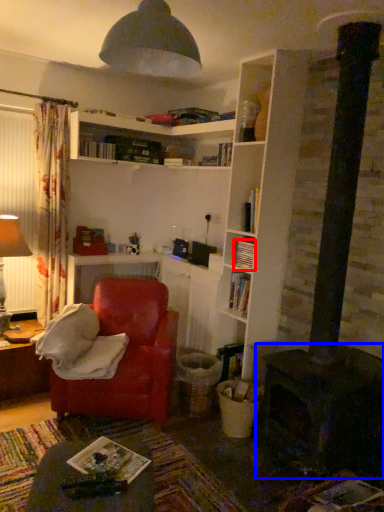
Question: Which object appears closest to the camera in this image, book (highlighted by a red box) or fireplace (highlighted by a blue box)?

Choices:
 (A) book
 (B) fireplace

Answer: (B)